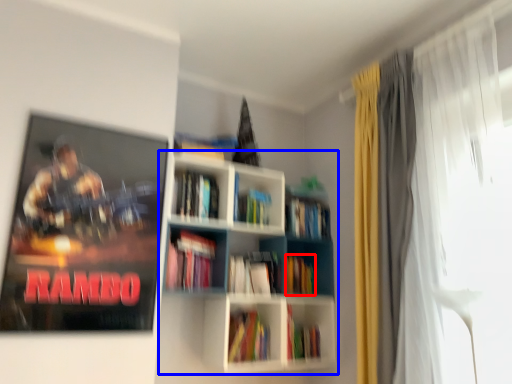
Question: Which object is further to the camera taking this photo, book (highlighted by a red box) or bookcase (highlighted by a blue box)?

Choices:
 (A) book
 (B) bookcase

Answer: (A)